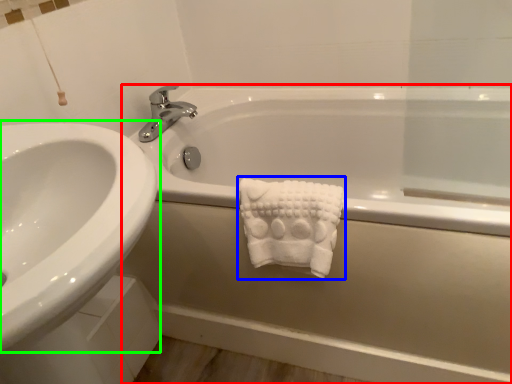
Question: Which object is positioned farthest from bathtub (highlighted by a red box)? Select from bath towel (highlighted by a blue box) and sink (highlighted by a green box).

Choices:
 (A) bath towel
 (B) sink

Answer: (B)